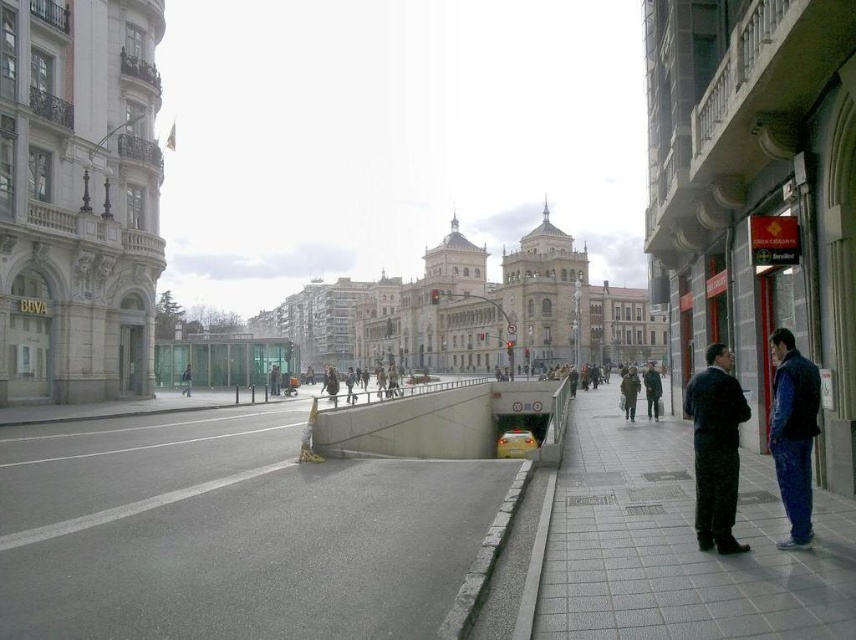
You are a delivery person carrying a large package and need to step over the gray concrete curb at lower center. You also see a dark blue fabric coat at right. Which object is taller, requiring you to be cautious when stepping over the curb?

The dark blue fabric coat at right is taller than the gray concrete curb at lower center, so you should be cautious of the coat when stepping over the curb.

You are standing on the gray concrete pavement at center and want to reach the blue fleece jacket at right. Which direction should you move to get there?

You should move to the right because the gray concrete pavement at center is to the left of the blue fleece jacket at right.

You are a delivery person carrying a large package that is 1.5 meters wide. You need to pass through the narrowest point between the dark blue fabric coat at right and the gray concrete curb at lower center. Can your package fit through?

The dark blue fabric coat at right is wider than the gray concrete curb at lower center. Since the package is 1.5 meters wide, it can fit through the narrowest point as long as the curb is at least 1.5 meters wide. However, since the coat is wider, the curb must be narrower than the coat. Therefore, the curb might be narrower than 1.5 meters, so the package may not fit. Without exact measurements, it is uncertain.